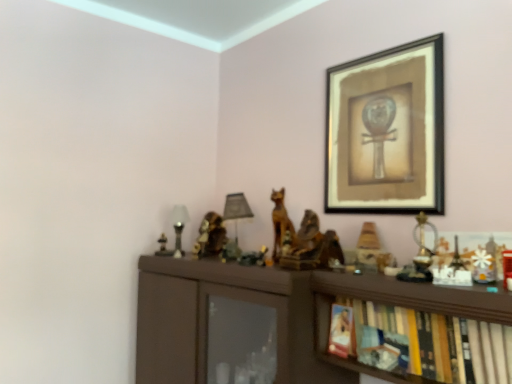
Question: Should I look upward or downward to see wooden figurine at center-right, the 2th toy in the left-to-right sequence?

Choices:
 (A) down
 (B) up

Answer: (A)

Question: From a real-world perspective, is matte black table lamp at center, the 2th table lamp positioned from the left, below wooden bookshelf at lower right?

Choices:
 (A) no
 (B) yes

Answer: (A)

Question: Does matte black table lamp at center, the 1th table lamp viewed from the right, come behind wooden bookshelf at lower right?

Choices:
 (A) no
 (B) yes

Answer: (B)

Question: Are matte black table lamp at center, the 1th table lamp viewed from the right, and wooden bookshelf at lower right far apart?

Choices:
 (A) no
 (B) yes

Answer: (A)

Question: Is matte black table lamp at center, the 1th table lamp viewed from the right, facing towards wooden bookshelf at lower right?

Choices:
 (A) yes
 (B) no

Answer: (B)

Question: From the image's perspective, is matte black table lamp at center, the 2th table lamp positioned from the left, below wooden bookshelf at lower right?

Choices:
 (A) yes
 (B) no

Answer: (B)

Question: Is wooden bookshelf at lower right inside matte black table lamp at center, the 1th table lamp viewed from the right?

Choices:
 (A) no
 (B) yes

Answer: (A)

Question: Considering the relative sizes of wooden statue at center and wooden bookshelf at lower right in the image provided, is wooden statue at center thinner than wooden bookshelf at lower right?

Choices:
 (A) no
 (B) yes

Answer: (B)

Question: From the image's perspective, is wooden statue at center located above wooden bookshelf at lower right?

Choices:
 (A) yes
 (B) no

Answer: (A)

Question: Is wooden statue at center bigger than wooden bookshelf at lower right?

Choices:
 (A) no
 (B) yes

Answer: (A)

Question: Is the surface of wooden statue at center in direct contact with wooden bookshelf at lower right?

Choices:
 (A) yes
 (B) no

Answer: (B)

Question: Is the position of wooden statue at center less distant than that of wooden bookshelf at lower right?

Choices:
 (A) no
 (B) yes

Answer: (A)

Question: Is wooden statue at center wider than wooden bookshelf at lower right?

Choices:
 (A) no
 (B) yes

Answer: (A)

Question: Is matte glass table lamp at left, which ranks as the 2th table lamp in right-to-left order, facing towards black matte picture frame at upper right?

Choices:
 (A) yes
 (B) no

Answer: (B)